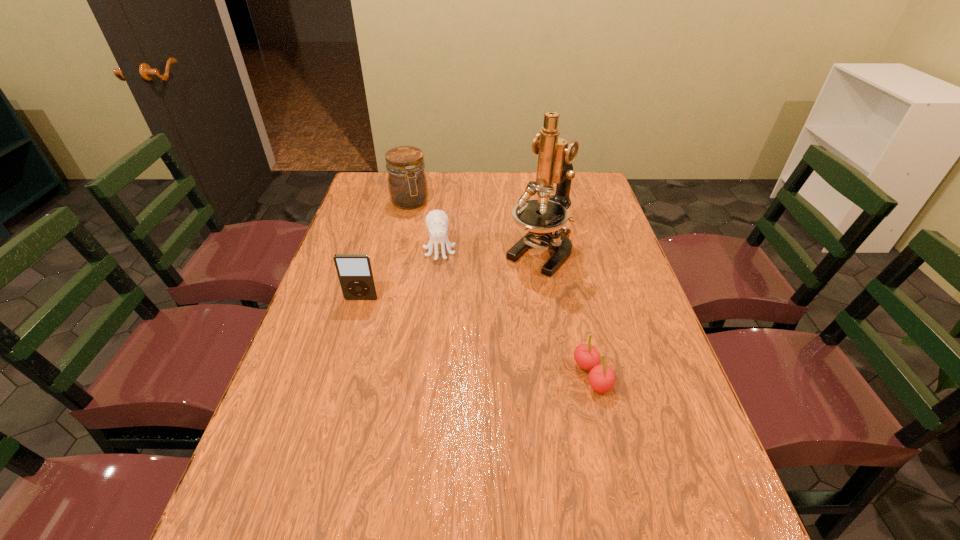
At what (x,y) coordinates should I click in order to perform the action: click on object situated at the far edge. Please return your answer as a coordinate pair (x, y). The image size is (960, 540). Looking at the image, I should click on (407, 183).

This screenshot has width=960, height=540. In order to click on iPod that is at the left edge in this screenshot , I will do `click(355, 272)`.

The width and height of the screenshot is (960, 540). Identify the location of jar that is at the left edge. (407, 183).

The height and width of the screenshot is (540, 960). What are the coordinates of `cherry present at the right edge` in the screenshot? It's located at (601, 377).

Where is `microscope positioned at the right edge`? microscope positioned at the right edge is located at coordinates (x=544, y=219).

This screenshot has width=960, height=540. In order to click on object that is at the far left corner in this screenshot , I will do `click(407, 183)`.

Find the location of a particular element. This screenshot has width=960, height=540. free space at the far edge of the desktop is located at coordinates (444, 178).

The image size is (960, 540). What are the coordinates of `vacant space at the near edge` in the screenshot? It's located at (518, 496).

In the image, there is a desktop. Find the location of `vacant space at the left edge`. vacant space at the left edge is located at coordinates click(x=355, y=253).

Identify the location of free region at the right edge. The height and width of the screenshot is (540, 960). (640, 288).